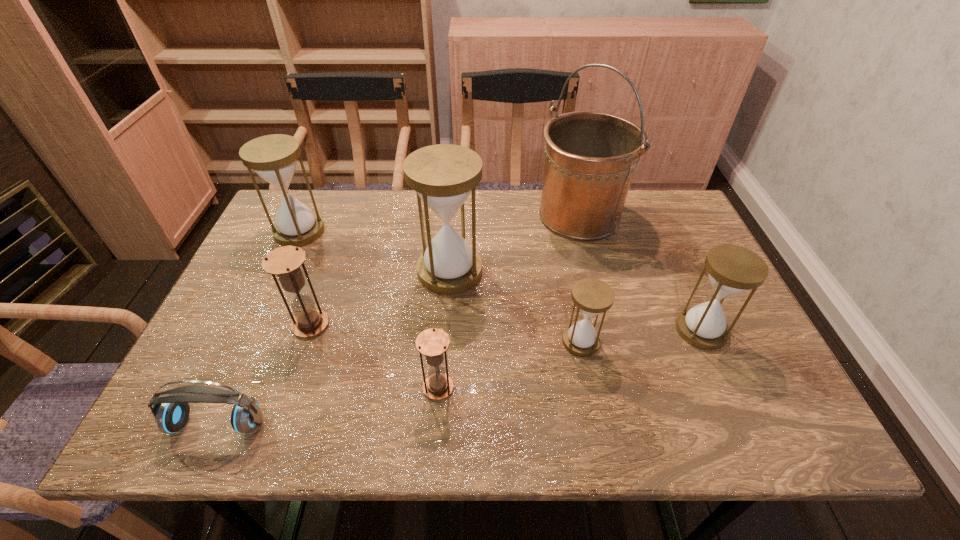
Where is `the third white hourglass from left to right`? the third white hourglass from left to right is located at coordinates (591, 296).

Image resolution: width=960 pixels, height=540 pixels. In order to click on the nearer brown hourglass in this screenshot , I will do `click(433, 343)`.

The image size is (960, 540). In order to click on the nearest hourglass in this screenshot , I will do `click(433, 343)`.

At what (x,y) coordinates should I click in order to perform the action: click on the nearest object. Please return your answer as a coordinate pair (x, y). Image resolution: width=960 pixels, height=540 pixels. Looking at the image, I should click on (171, 416).

Where is `blue headset`? blue headset is located at coordinates (171, 416).

Locate an element on the screen. vacant space located on the left of the tallest object is located at coordinates tap(515, 216).

The image size is (960, 540). In order to click on vacant space located 0.320m on the right of the tallest hourglass in this screenshot , I will do `click(602, 271)`.

Find the location of a particular element. Image resolution: width=960 pixels, height=540 pixels. free space located 0.070m on the right of the leftmost white hourglass is located at coordinates (348, 232).

Locate an element on the screen. The height and width of the screenshot is (540, 960). vacant region located 0.150m on the right of the second hourglass from left to right is located at coordinates (393, 325).

Where is `free point located on the left of the rightmost white hourglass`? The width and height of the screenshot is (960, 540). free point located on the left of the rightmost white hourglass is located at coordinates (587, 330).